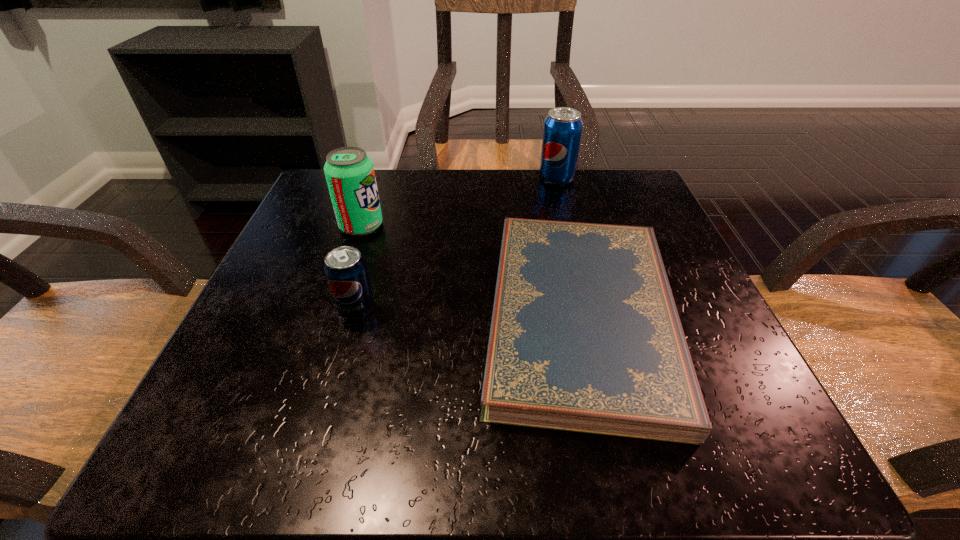
I want to click on free region at the far left corner of the desktop, so click(x=323, y=176).

In order to click on vacant area at the near left corner in this screenshot , I will do `click(226, 405)`.

Identify the location of free space at the far right corner. This screenshot has height=540, width=960. tap(580, 196).

Locate an element on the screen. The height and width of the screenshot is (540, 960). vacant region between the rightmost soda can and the shortest soda can is located at coordinates (456, 244).

Where is `free point between the shortest object and the shortest soda can`? free point between the shortest object and the shortest soda can is located at coordinates (468, 313).

Where is `vacant space that is in between the second farthest soda can and the paperback book`? vacant space that is in between the second farthest soda can and the paperback book is located at coordinates (470, 271).

Locate an element on the screen. The width and height of the screenshot is (960, 540). vacant area between the paperback book and the nearest soda can is located at coordinates (468, 313).

Where is `free area in between the second farthest soda can and the rightmost soda can`? This screenshot has width=960, height=540. free area in between the second farthest soda can and the rightmost soda can is located at coordinates (459, 202).

I want to click on vacant space that's between the paperback book and the second nearest soda can, so click(x=470, y=271).

You are a GUI agent. You are given a task and a screenshot of the screen. Output one action in this format:
    pyautogui.click(x=<x>, y=<y>)
    Task: Click on the empty location between the farthest object and the second farthest soda can
    
    Given the screenshot: What is the action you would take?
    pyautogui.click(x=459, y=202)